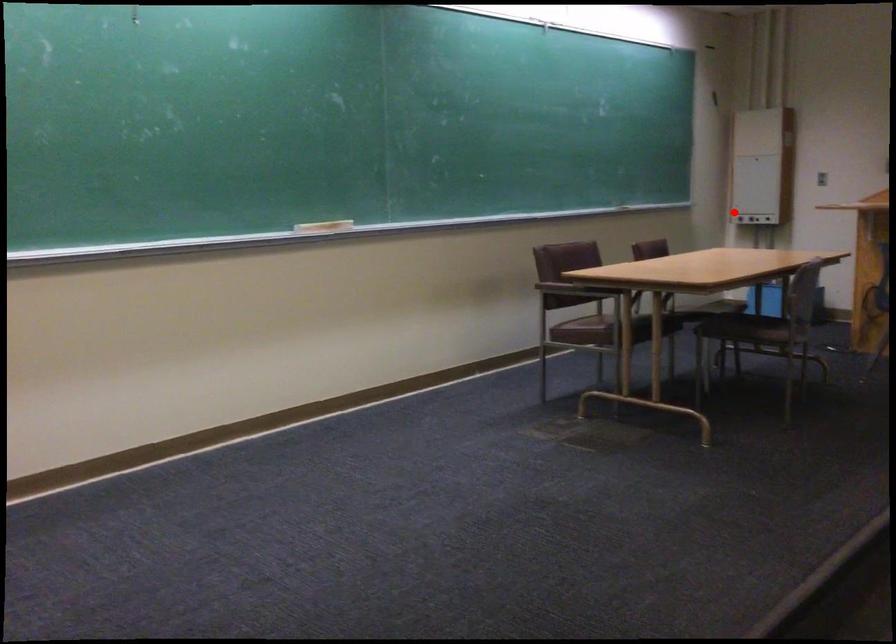
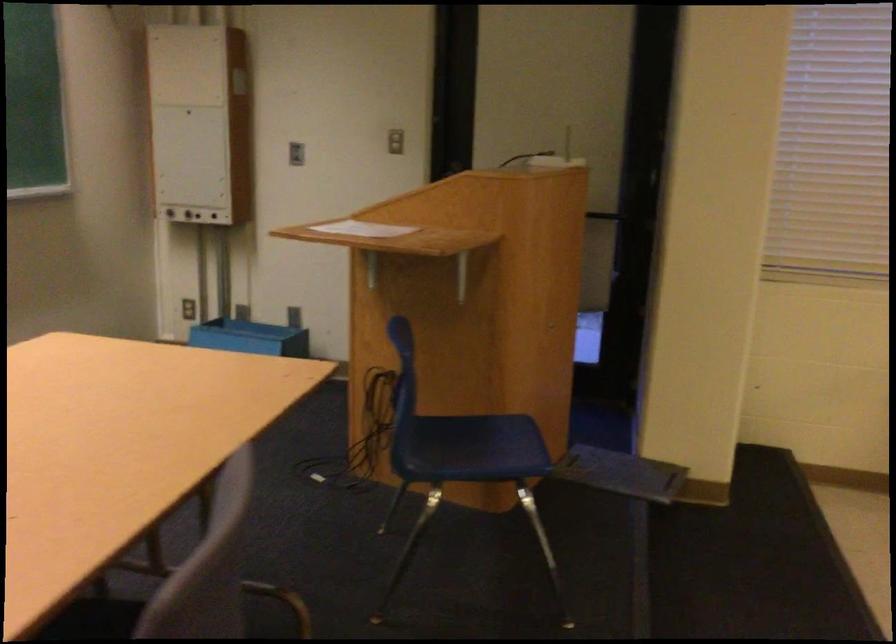
Locate, in the second image, the point that corresponds to the highlighted location in the first image.

(167, 210)